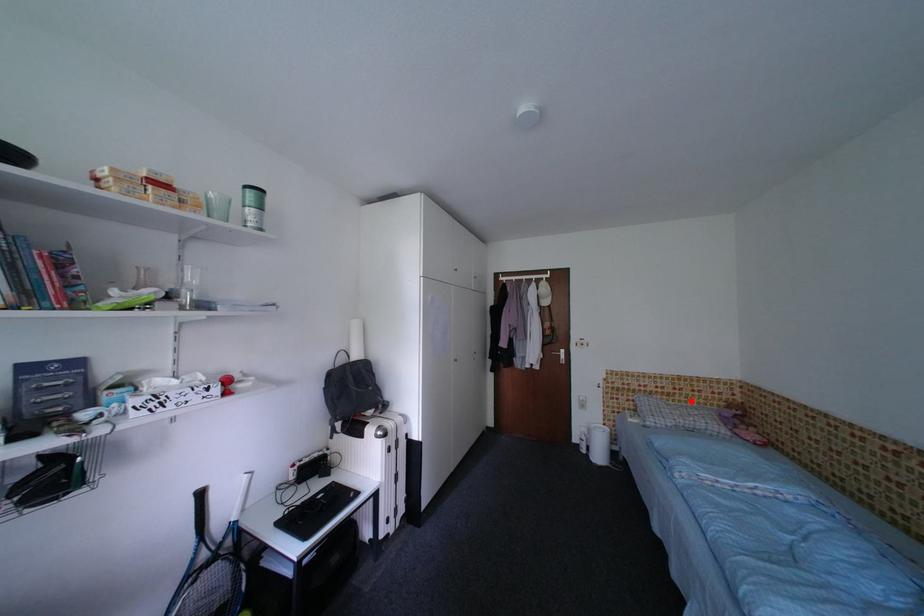
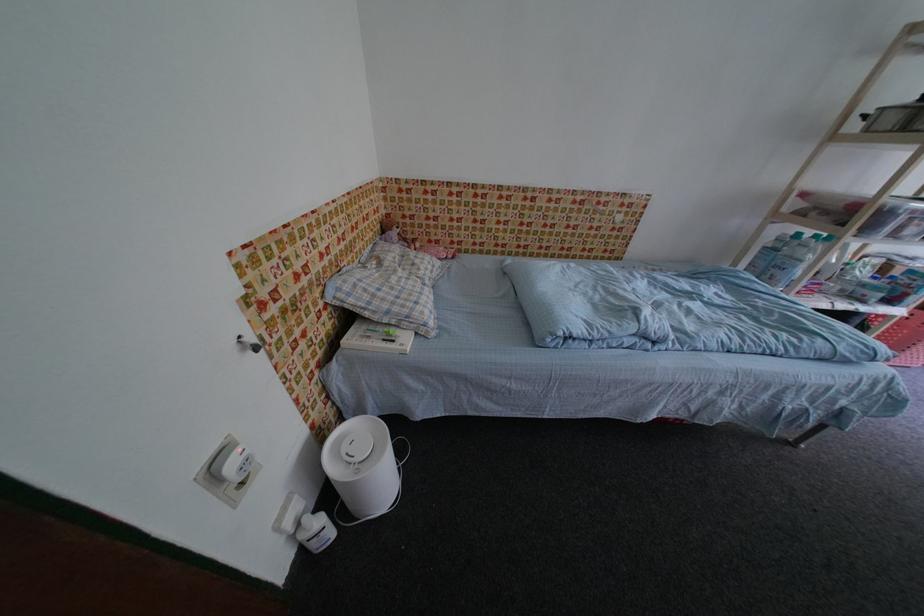
Question: I am providing you with two images of the same scene from different viewpoints. In image1, a red point is highlighted. Considering the same 3D point in image2, which of the following is correct?

Choices:
 (A) It is closer
 (B) It is farther

Answer: (A)